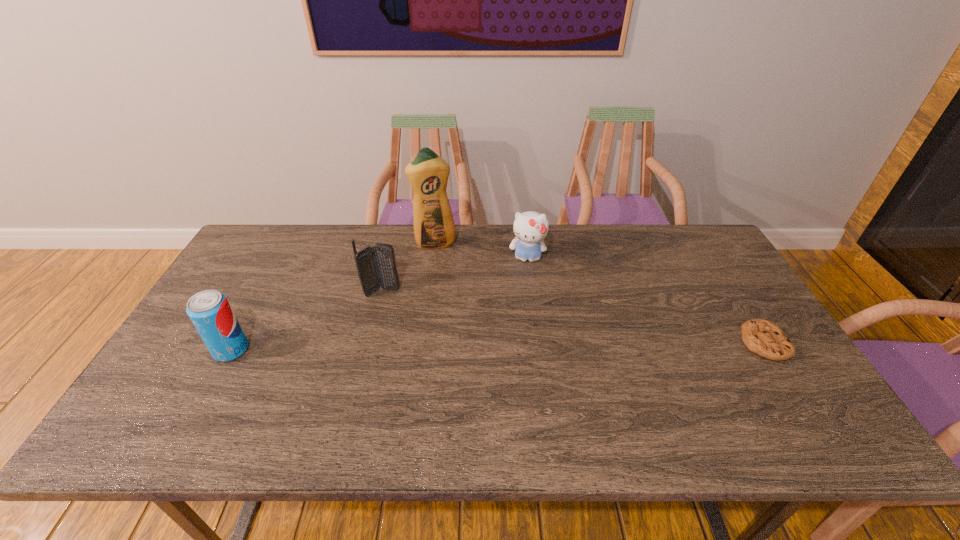
The height and width of the screenshot is (540, 960). In order to click on vacant space on the desktop that is between the leftmost object and the cookie and is positioned on the label of the detergent in this screenshot , I will do `click(465, 347)`.

Find the location of `free spot on the desktop that is between the leftmost object and the cookie and is positioned on the front-facing side of the kitten`. free spot on the desktop that is between the leftmost object and the cookie and is positioned on the front-facing side of the kitten is located at coordinates (523, 346).

This screenshot has height=540, width=960. I want to click on vacant spot on the desktop that is between the leftmost object and the cookie and is positioned on the keyboard of the cellular telephone, so click(465, 347).